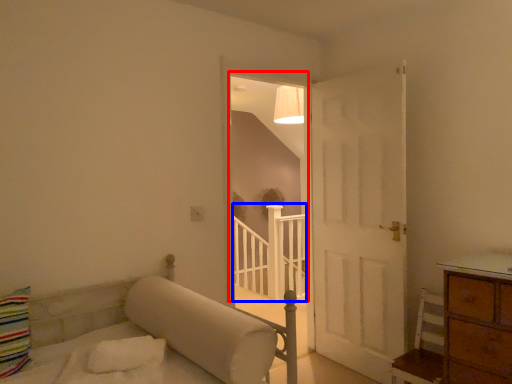
Question: Among these objects, which one is farthest to the camera, window (highlighted by a red box) or balustrade (highlighted by a blue box)?

Choices:
 (A) window
 (B) balustrade

Answer: (B)